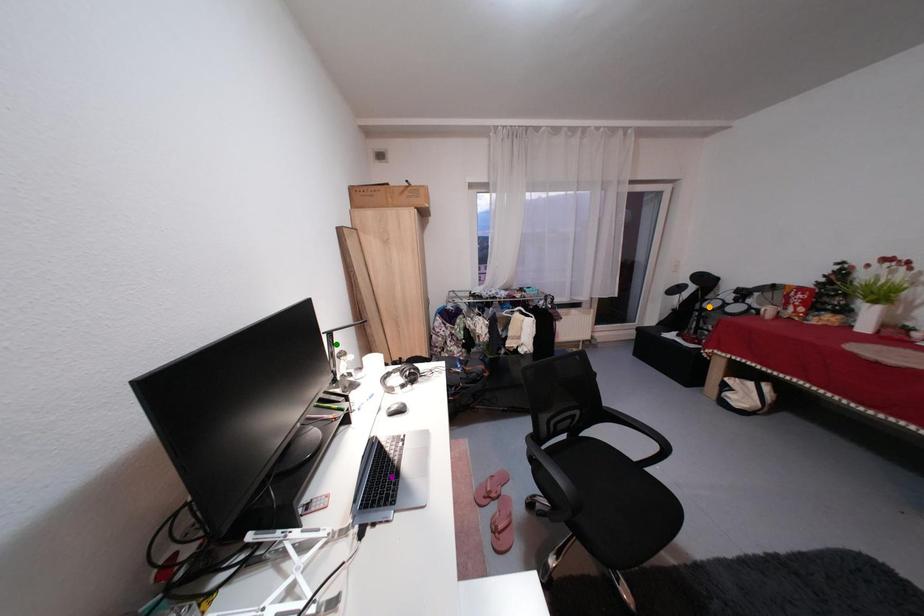
Order these from farthest to nearest:
1. purple point
2. orange point
3. green point

1. orange point
2. green point
3. purple point